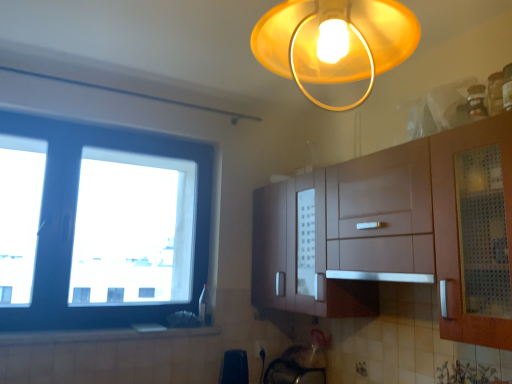
Question: From a real-world perspective, is satin silver exhaust hood at center positioned above or below white glossy electric outlet at lower center?

Choices:
 (A) above
 (B) below

Answer: (A)

Question: Considering their positions, is satin silver exhaust hood at center located in front of or behind white glossy electric outlet at lower center?

Choices:
 (A) front
 (B) behind

Answer: (A)

Question: Considering the real-world distances, which object is farthest from the satin silver exhaust hood at center?

Choices:
 (A) matte yellow plastic lampshade at upper center
 (B) black plastic bag at lower center
 (C) white glossy electric outlet at lower center
 (D) blue plastic window at left
 (E) white glossy countertop at lower left

Answer: (D)

Question: Which object is the farthest from the matte yellow plastic lampshade at upper center?

Choices:
 (A) white glossy electric outlet at lower center
 (B) satin silver exhaust hood at center
 (C) black plastic bag at lower center
 (D) blue plastic window at left
 (E) white glossy countertop at lower left

Answer: (D)